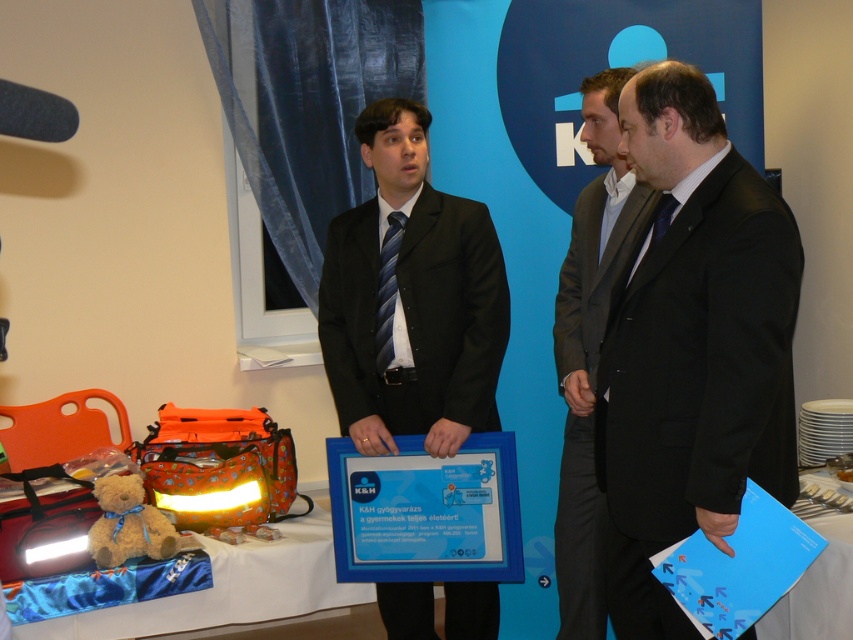
Is white satin table at lower left to the right of white glossy table at lower right from the viewer's perspective?

In fact, white satin table at lower left is to the left of white glossy table at lower right.

Who is shorter, white satin table at lower left or white glossy table at lower right?

Standing shorter between the two is white satin table at lower left.

Does point (235, 573) come closer to viewer compared to point (764, 628)?

No, it is behind (764, 628).

What are the coordinates of `white satin table at lower left` in the screenshot? It's located at (230, 588).

Can you confirm if black matte suit at center is smaller than soft brown teddy bear at lower left?

No, black matte suit at center is not smaller than soft brown teddy bear at lower left.

Can you confirm if black matte suit at center is positioned above soft brown teddy bear at lower left?

Correct, black matte suit at center is located above soft brown teddy bear at lower left.

Is point (767, 397) farther from viewer compared to point (120, 499)?

No, it is not.

At what (x,y) coordinates should I click in order to perform the action: click on black matte suit at center. Please return your answer as a coordinate pair (x, y). Looking at the image, I should click on coord(692,348).

Between black matte suit at center and black suit at center, which one is positioned higher?

black suit at center

The height and width of the screenshot is (640, 853). What do you see at coordinates (692, 348) in the screenshot?
I see `black matte suit at center` at bounding box center [692, 348].

The width and height of the screenshot is (853, 640). Find the location of `black matte suit at center`. black matte suit at center is located at coordinates (692, 348).